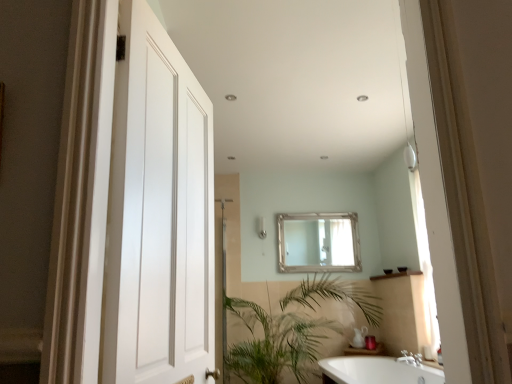
Question: Is white glossy bathtub at lower right not inside silver metallic mirror at center?

Choices:
 (A) yes
 (B) no

Answer: (A)

Question: Is the depth of white glossy bathtub at lower right greater than that of silver metallic mirror at center?

Choices:
 (A) yes
 (B) no

Answer: (B)

Question: From the image's perspective, is white glossy bathtub at lower right under silver metallic mirror at center?

Choices:
 (A) yes
 (B) no

Answer: (A)

Question: Considering the relative sizes of white glossy bathtub at lower right and silver metallic mirror at center in the image provided, is white glossy bathtub at lower right shorter than silver metallic mirror at center?

Choices:
 (A) no
 (B) yes

Answer: (B)

Question: Could you tell me if white glossy bathtub at lower right is facing silver metallic mirror at center?

Choices:
 (A) yes
 (B) no

Answer: (B)

Question: Can you confirm if white glossy bathtub at lower right is wider than silver metallic mirror at center?

Choices:
 (A) yes
 (B) no

Answer: (A)

Question: Is satin nickel shower at center completely or partially inside green leafy plant at lower center?

Choices:
 (A) yes
 (B) no

Answer: (B)

Question: Does green leafy plant at lower center appear on the right side of satin nickel shower at center?

Choices:
 (A) no
 (B) yes

Answer: (B)

Question: Is green leafy plant at lower center not within satin nickel shower at center?

Choices:
 (A) no
 (B) yes

Answer: (B)

Question: Considering the relative sizes of green leafy plant at lower center and satin nickel shower at center in the image provided, is green leafy plant at lower center taller than satin nickel shower at center?

Choices:
 (A) no
 (B) yes

Answer: (B)

Question: Does green leafy plant at lower center have a greater width compared to satin nickel shower at center?

Choices:
 (A) yes
 (B) no

Answer: (A)

Question: Is green leafy plant at lower center facing towards satin nickel shower at center?

Choices:
 (A) no
 (B) yes

Answer: (A)

Question: From a real-world perspective, is green leafy plant at lower center positioned under silver metallic mirror at center based on gravity?

Choices:
 (A) yes
 (B) no

Answer: (A)